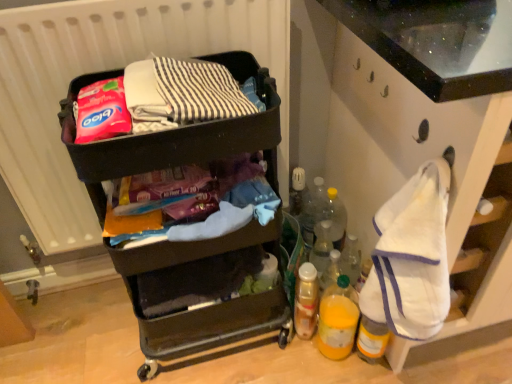
Identify the location of free location to the left of translucent yellow bottle at lower right, the 1th bottle when ordered from bottom to top. (286, 352).